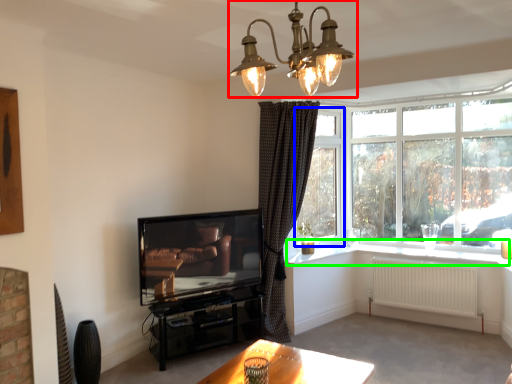
Question: Estimate the real-world distances between objects in this image. Which object is farther from lamp (highlighted by a red box), window screen (highlighted by a blue box) or window sill (highlighted by a green box)?

Choices:
 (A) window screen
 (B) window sill

Answer: (A)